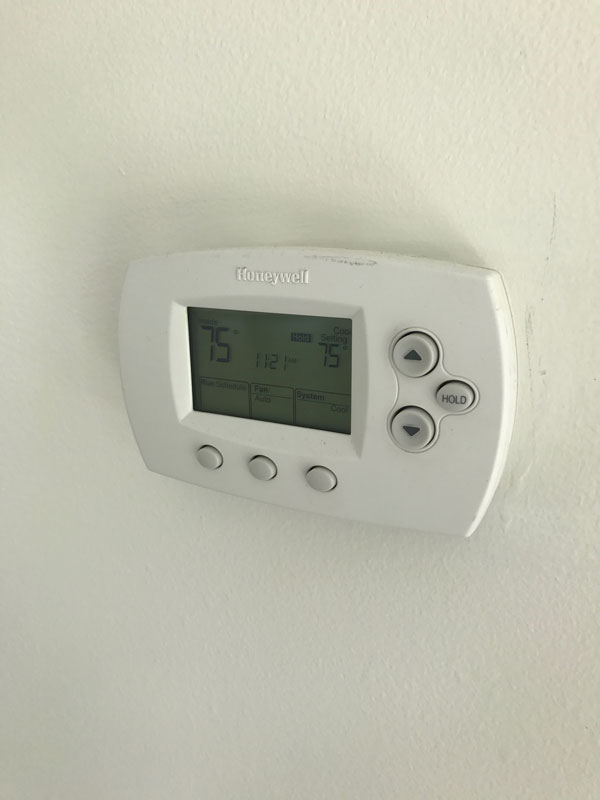
Locate an element on the screen. white wall is located at coordinates (393, 730).